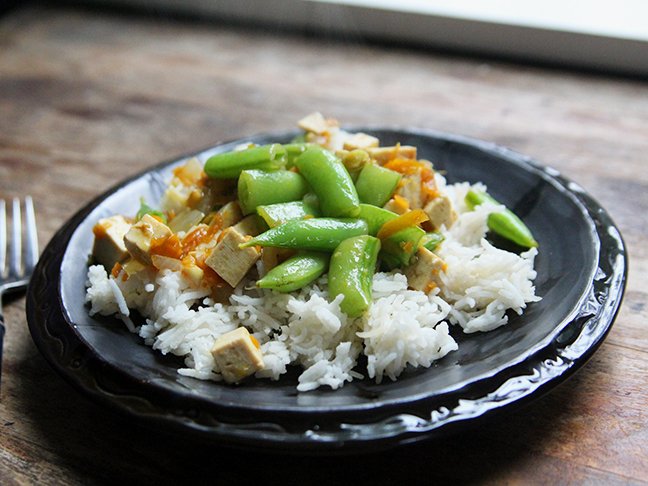
Image resolution: width=648 pixels, height=486 pixels. Find the location of `fork`. fork is located at coordinates (14, 280).